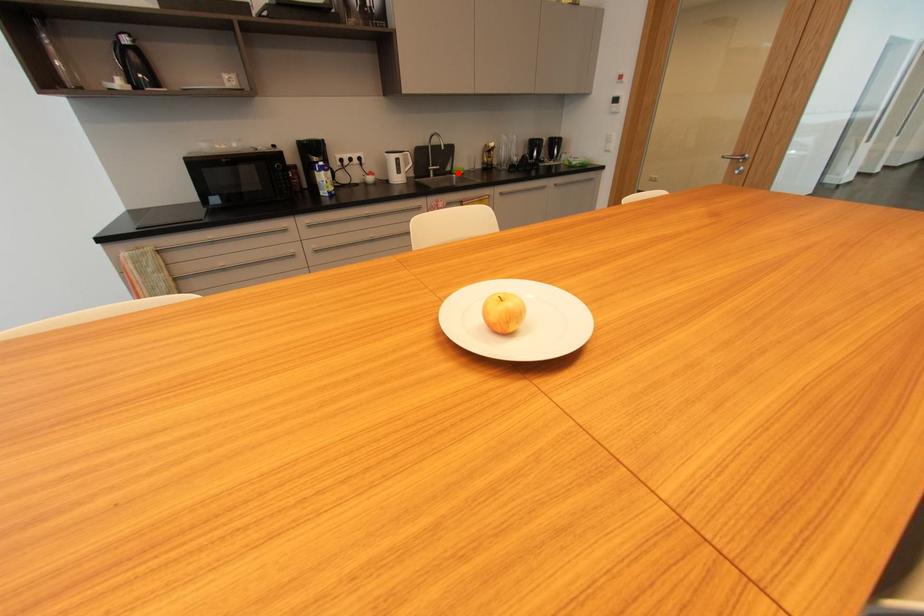
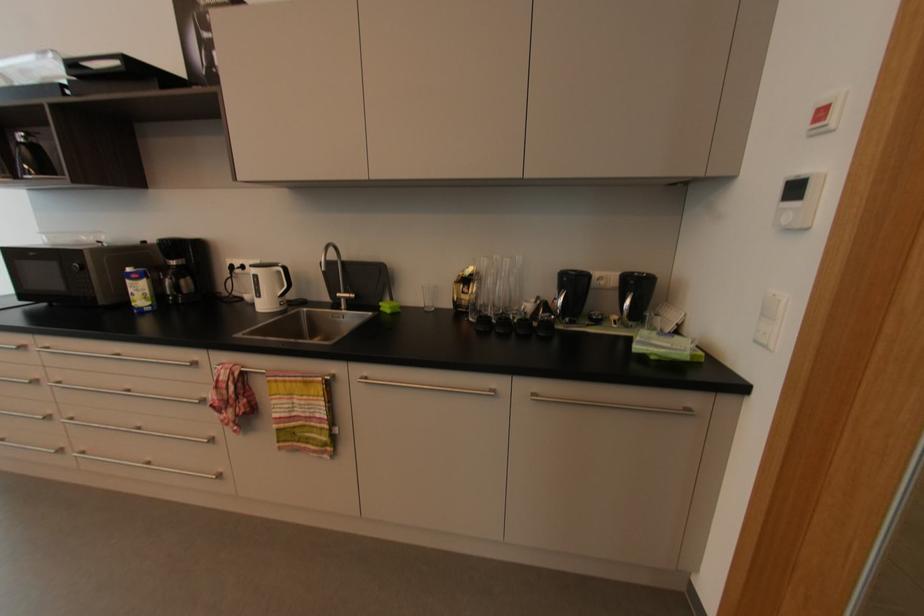
Find the pixel in the second image that matches the highlighted location in the first image.

(384, 309)